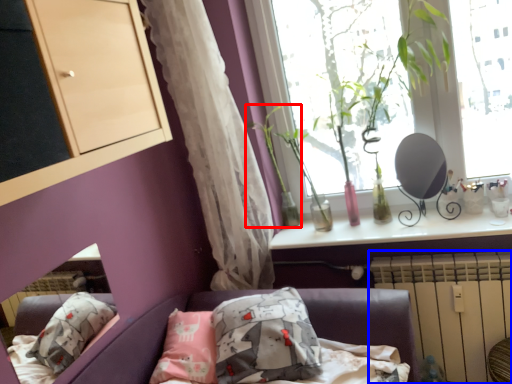
Question: Which object appears farthest to the camera in this image, plant (highlighted by a red box) or radiator (highlighted by a blue box)?

Choices:
 (A) plant
 (B) radiator

Answer: (A)